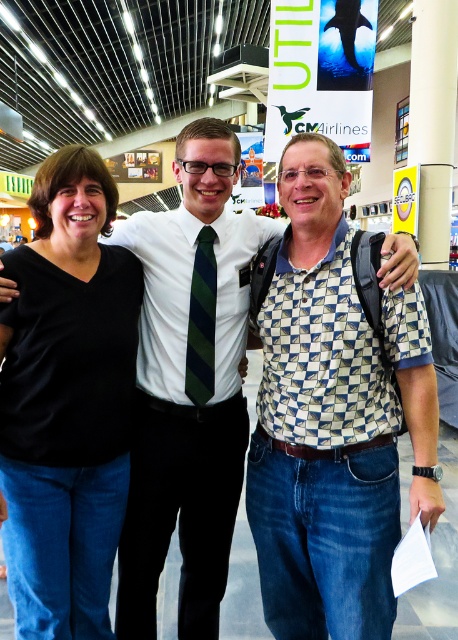
You are a photographer setting up for a group photo at an airport. You need to ensure that the black matte shirt at left and the green striped tie at center are both clearly visible in the frame. Given that your camera has a minimum focus distance of 16 inches, will you be able to capture both subjects in focus without moving the camera closer?

The black matte shirt at left is 16.89 inches away from the green striped tie at center. Since the minimum focus distance of the camera is 16 inches, the 16.89 inch separation between the two subjects is sufficient for both to be in focus. Therefore, you can capture both the black matte shirt at left and the green striped tie at center without needing to move the camera closer.

You are at an airport and see two items in the image, the checkered fabric shirt at center and the green striped tie at center. Which item is positioned to the right of the other?

The checkered fabric shirt at center is to the right of the green striped tie at center according to the description.